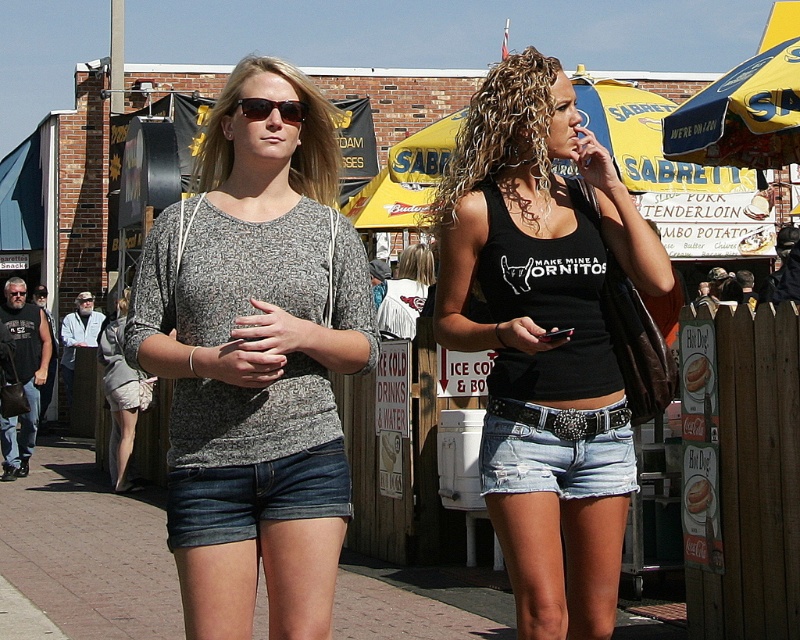
Can you confirm if black matte tank top at center is positioned above matte black sunglasses at center?

Actually, black matte tank top at center is below matte black sunglasses at center.

Does black matte tank top at center have a greater height compared to matte black sunglasses at center?

Correct, black matte tank top at center is much taller as matte black sunglasses at center.

Is point (462, 141) positioned after point (277, 108)?

Yes.

I want to click on black matte tank top at center, so click(x=544, y=337).

Who is more distant from viewer, (220,429) or (612,573)?

Positioned behind is point (612,573).

Based on the photo, does gray heathered shirt at center have a greater width compared to black matte tank top at center?

Incorrect, gray heathered shirt at center's width does not surpass black matte tank top at center's.

Describe the element at coordinates (256, 360) in the screenshot. The height and width of the screenshot is (640, 800). I see `gray heathered shirt at center` at that location.

Find the location of a particular element. This screenshot has width=800, height=640. gray heathered shirt at center is located at coordinates (256, 360).

This screenshot has height=640, width=800. I want to click on gray heathered shirt at center, so click(256, 360).

Which of these two, gray heathered shirt at center or matte black sunglasses at center, stands shorter?

With less height is matte black sunglasses at center.

Locate an element on the screen. The image size is (800, 640). gray heathered shirt at center is located at coordinates (256, 360).